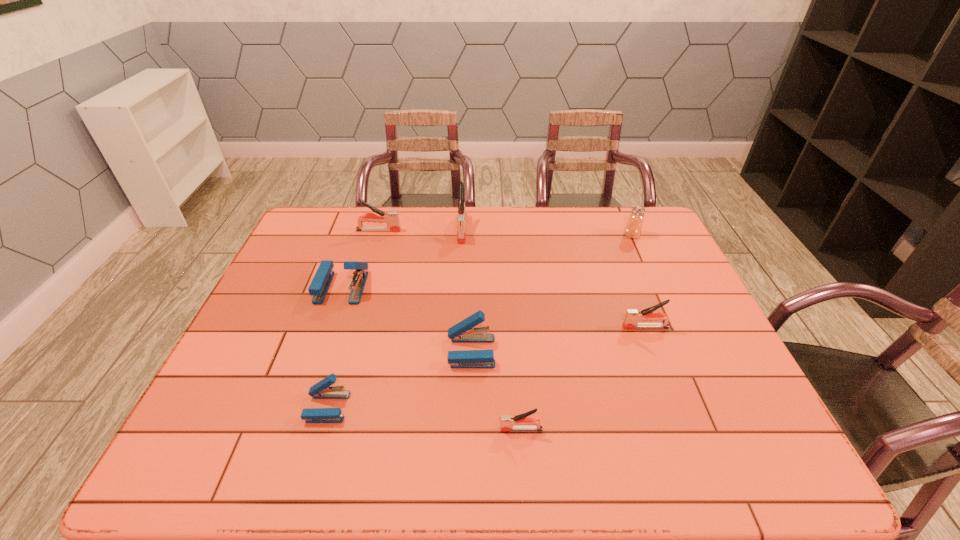
The height and width of the screenshot is (540, 960). Find the location of `the biggest gray stapler`. the biggest gray stapler is located at coordinates (461, 237).

Identify the location of the second gray stapler from left to right. (461, 237).

Locate an element on the screen. This screenshot has height=540, width=960. the third smallest gray stapler is located at coordinates (391, 218).

Identify the location of the biggest blue stapler. This screenshot has height=540, width=960. (320, 284).

Locate an element on the screen. The image size is (960, 540). the fourth farthest object is located at coordinates (320, 284).

Image resolution: width=960 pixels, height=540 pixels. Find the location of `saltshaker`. saltshaker is located at coordinates (633, 228).

The image size is (960, 540). Find the location of `the rightmost stapler`. the rightmost stapler is located at coordinates (633, 316).

The width and height of the screenshot is (960, 540). What are the coordinates of `the fourth nearest object` in the screenshot? It's located at (633, 316).

Locate an element on the screen. Image resolution: width=960 pixels, height=540 pixels. the rightmost blue stapler is located at coordinates (463, 332).

Where is `the second nearest blue stapler`? This screenshot has height=540, width=960. the second nearest blue stapler is located at coordinates (463, 332).